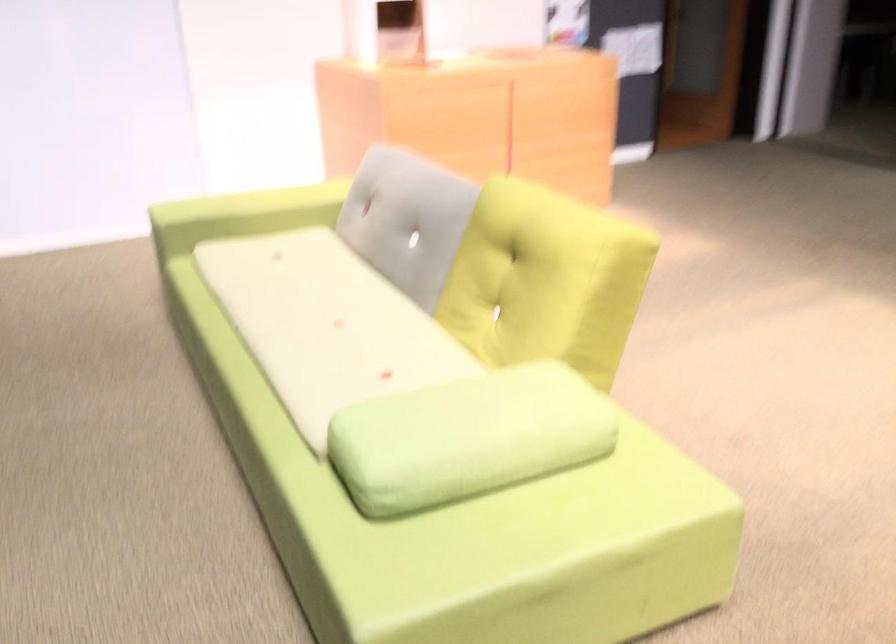
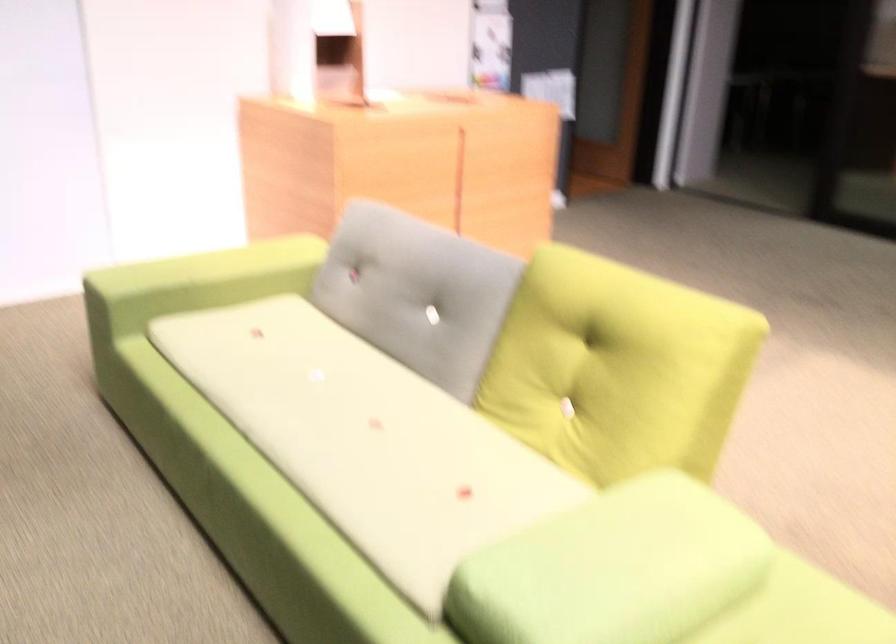
Where in the second image is the point corresponding to (323,335) from the first image?

(366, 439)